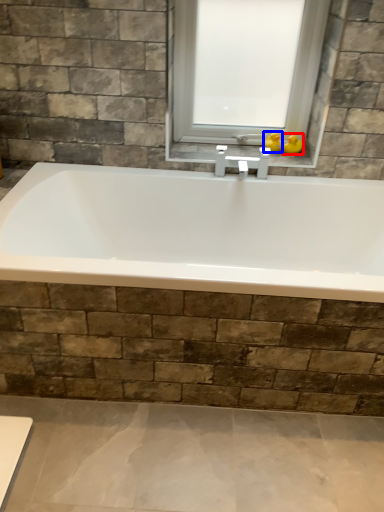
Question: Which object appears closest to the camera in this image, duck (highlighted by a red box) or duck (highlighted by a blue box)?

Choices:
 (A) duck
 (B) duck

Answer: (A)